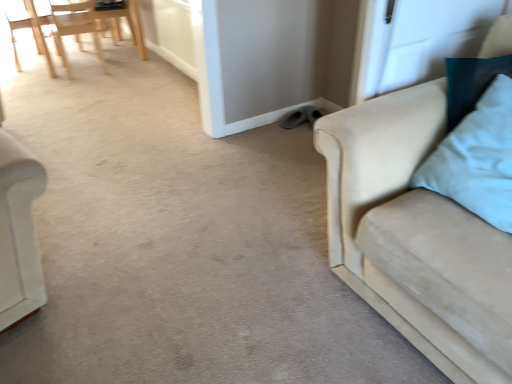
Question: Is gray suede shoes at center bigger than light blue fabric pillow at right?

Choices:
 (A) no
 (B) yes

Answer: (A)

Question: Is light blue fabric pillow at right inside gray suede shoes at center?

Choices:
 (A) no
 (B) yes

Answer: (A)

Question: Does gray suede shoes at center have a lesser width compared to light blue fabric pillow at right?

Choices:
 (A) yes
 (B) no

Answer: (A)

Question: Considering the relative positions of gray suede shoes at center and light blue fabric pillow at right in the image provided, is gray suede shoes at center to the right of light blue fabric pillow at right from the viewer's perspective?

Choices:
 (A) no
 (B) yes

Answer: (A)

Question: Is gray suede shoes at center to the left of light blue fabric pillow at right from the viewer's perspective?

Choices:
 (A) yes
 (B) no

Answer: (A)

Question: From a real-world perspective, is suede beige couch at right above or below light wood chair at upper left, arranged as the first chair when viewed from the left?

Choices:
 (A) below
 (B) above

Answer: (B)

Question: Is suede beige couch at right spatially inside light wood chair at upper left, arranged as the first chair when viewed from the left, or outside of it?

Choices:
 (A) inside
 (B) outside

Answer: (B)

Question: Relative to light wood chair at upper left, the third chair viewed from the right, is suede beige couch at right in front or behind?

Choices:
 (A) front
 (B) behind

Answer: (A)

Question: Considering the positions of suede beige couch at right and light wood chair at upper left, the third chair viewed from the right, in the image, is suede beige couch at right bigger or smaller than light wood chair at upper left, the third chair viewed from the right,?

Choices:
 (A) big
 (B) small

Answer: (A)

Question: Based on their positions, is light wood chair at upper left, the third chair viewed from the right, located to the left or right of white glossy screen door at upper right?

Choices:
 (A) right
 (B) left

Answer: (B)

Question: Does point (54, 74) appear closer or farther from the camera than point (452, 41)?

Choices:
 (A) farther
 (B) closer

Answer: (A)

Question: From their relative heights in the image, would you say light wood chair at upper left, the third chair viewed from the right, is taller or shorter than white glossy screen door at upper right?

Choices:
 (A) short
 (B) tall

Answer: (B)

Question: Is light wood chair at upper left, the third chair viewed from the right, bigger or smaller than white glossy screen door at upper right?

Choices:
 (A) small
 (B) big

Answer: (B)

Question: Considering their positions, is white glossy screen door at upper right located in front of or behind gray suede shoes at center?

Choices:
 (A) behind
 (B) front

Answer: (B)

Question: Considering the positions of white glossy screen door at upper right and gray suede shoes at center in the image, is white glossy screen door at upper right taller or shorter than gray suede shoes at center?

Choices:
 (A) tall
 (B) short

Answer: (A)